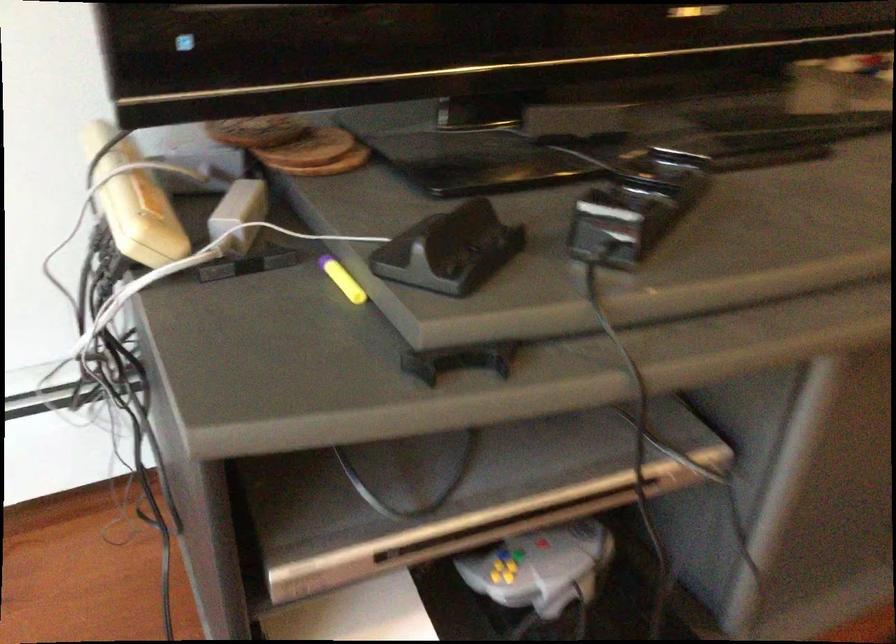
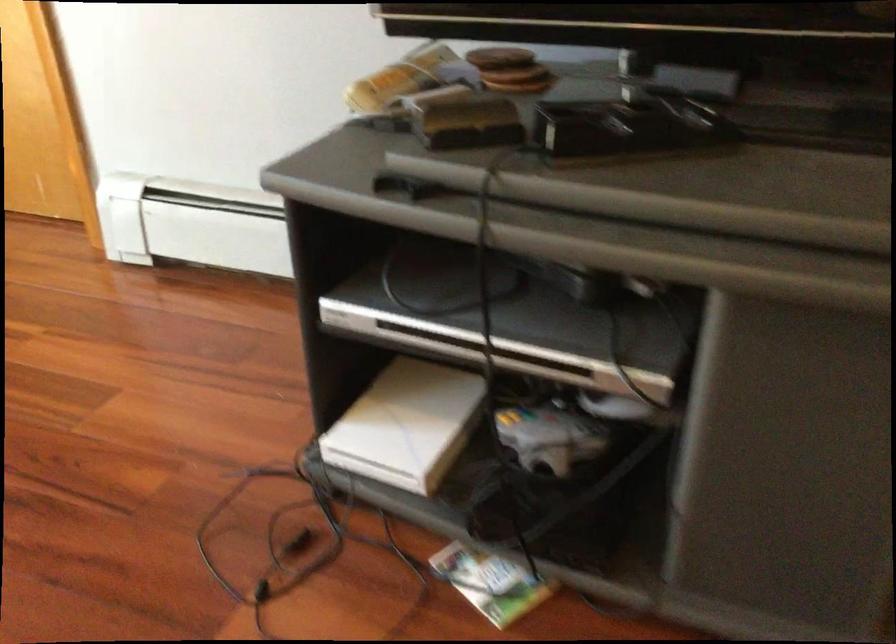
In the second image, find the point that corresponds to (x=524, y=469) in the first image.

(505, 321)